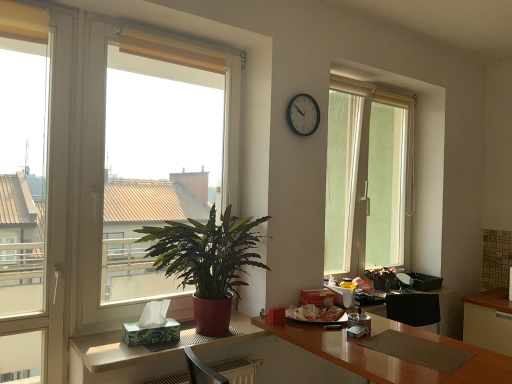
Find the location of a particular element. This screenshot has width=512, height=384. empty space that is ontop of beige fabric curtain at upper center (from a real-world perspective) is located at coordinates (168, 39).